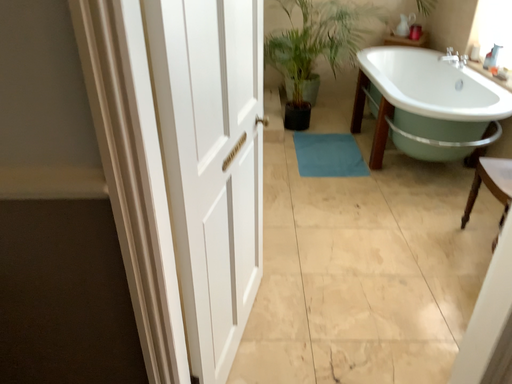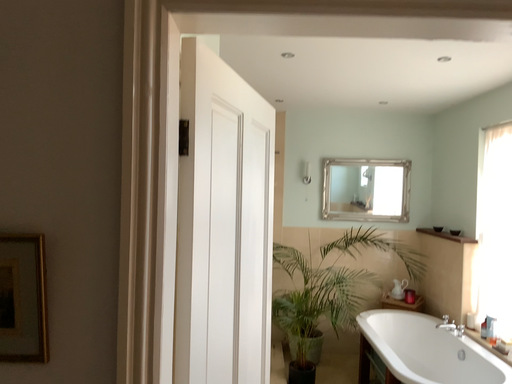
Question: Which way did the camera rotate in the video?

Choices:
 (A) rotated upward
 (B) rotated downward

Answer: (A)